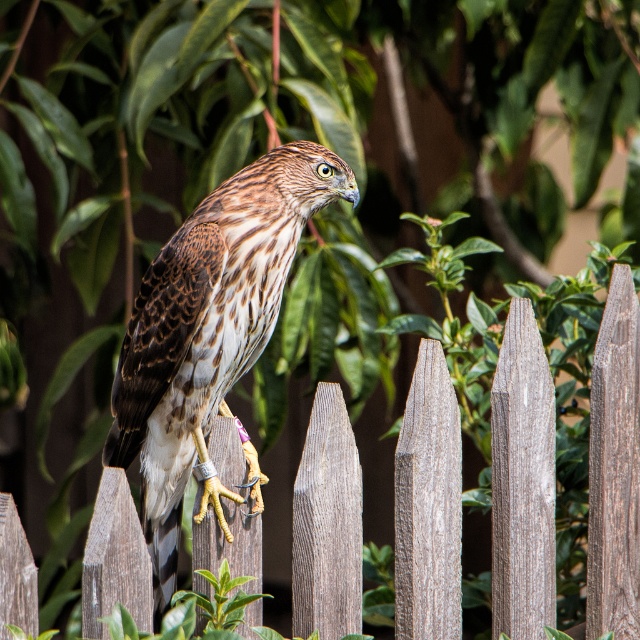
Question: Does wooden picket fence at center have a larger size compared to brown speckled feathers at center?

Choices:
 (A) no
 (B) yes

Answer: (B)

Question: Among these points, which one is nearest to the camera?

Choices:
 (A) (220, 358)
 (B) (512, 496)

Answer: (A)

Question: Which point is farther from the camera taking this photo?

Choices:
 (A) (150, 410)
 (B) (444, 468)

Answer: (B)

Question: Is wooden picket fence at center wider than brown speckled feathers at center?

Choices:
 (A) yes
 (B) no

Answer: (A)

Question: Which point appears farthest from the camera in this image?

Choices:
 (A) (516, 632)
 (B) (163, 250)

Answer: (A)

Question: Can you confirm if wooden picket fence at center is wider than brown speckled feathers at center?

Choices:
 (A) no
 (B) yes

Answer: (B)